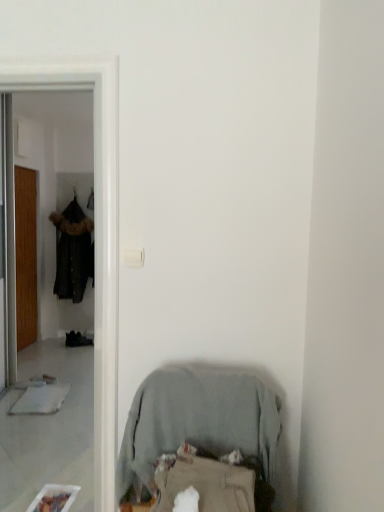
Question: Looking at the image, does dark brown fur-trimmed coat at left seem bigger or smaller compared to wooden door at left?

Choices:
 (A) small
 (B) big

Answer: (B)

Question: Is dark brown fur-trimmed coat at left inside the boundaries of wooden door at left, or outside?

Choices:
 (A) inside
 (B) outside

Answer: (B)

Question: Which of these objects is positioned closest to the transparent plastic screen door at left?

Choices:
 (A) wooden door at left
 (B) dark brown fur-trimmed coat at left
 (C) light gray fabric chair at lower center

Answer: (C)

Question: Estimate the real-world distances between objects in this image. Which object is closer to the wooden door at left?

Choices:
 (A) light gray fabric chair at lower center
 (B) dark brown fur-trimmed coat at left
 (C) transparent plastic screen door at left

Answer: (B)